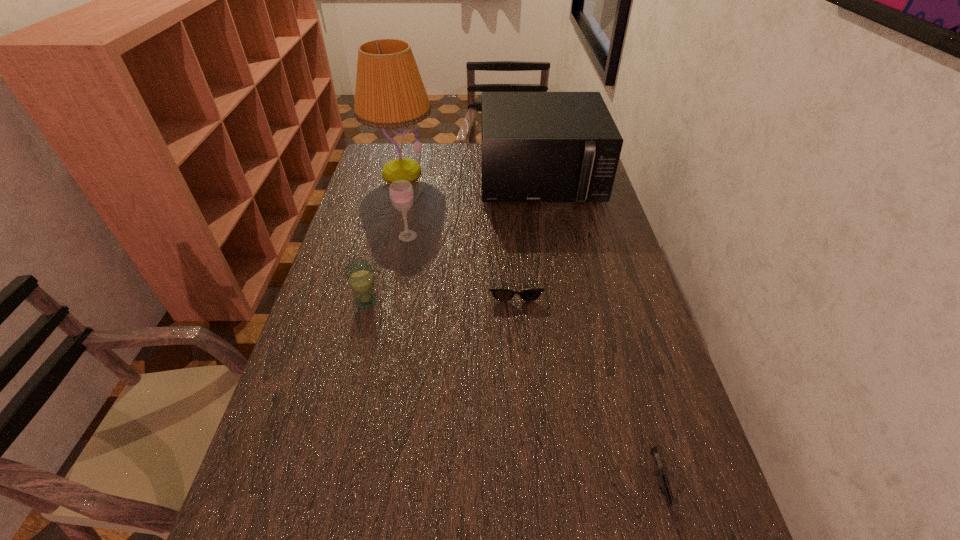
Image resolution: width=960 pixels, height=540 pixels. What are the coordinates of `the tallest object` in the screenshot? It's located at (389, 93).

Where is `the fifth shortest object`? The image size is (960, 540). the fifth shortest object is located at coordinates (536, 146).

Where is `the fourth nearest object`? Image resolution: width=960 pixels, height=540 pixels. the fourth nearest object is located at coordinates (401, 193).

Where is `wineglass`? wineglass is located at coordinates (401, 193).

Locate an element on the screen. The width and height of the screenshot is (960, 540). glass is located at coordinates (359, 273).

You are a GUI agent. You are given a task and a screenshot of the screen. Output one action in this format:
    pyautogui.click(x=<x>, y=<y>)
    Task: Click on the sunglasses
    Image resolution: width=960 pixels, height=540 pixels.
    Given the screenshot: What is the action you would take?
    pyautogui.click(x=500, y=294)

I want to click on the nearest object, so click(x=659, y=470).

Where is `vacant space situated 0.350m on the side of the lamp near the pull switch`? This screenshot has height=540, width=960. vacant space situated 0.350m on the side of the lamp near the pull switch is located at coordinates (381, 256).

Where is `free location located 0.330m on the front-facing side of the fifth shortest object`? The height and width of the screenshot is (540, 960). free location located 0.330m on the front-facing side of the fifth shortest object is located at coordinates (558, 278).

Where is `vacant space situated 0.160m on the back of the fourth nearest object`? vacant space situated 0.160m on the back of the fourth nearest object is located at coordinates (414, 200).